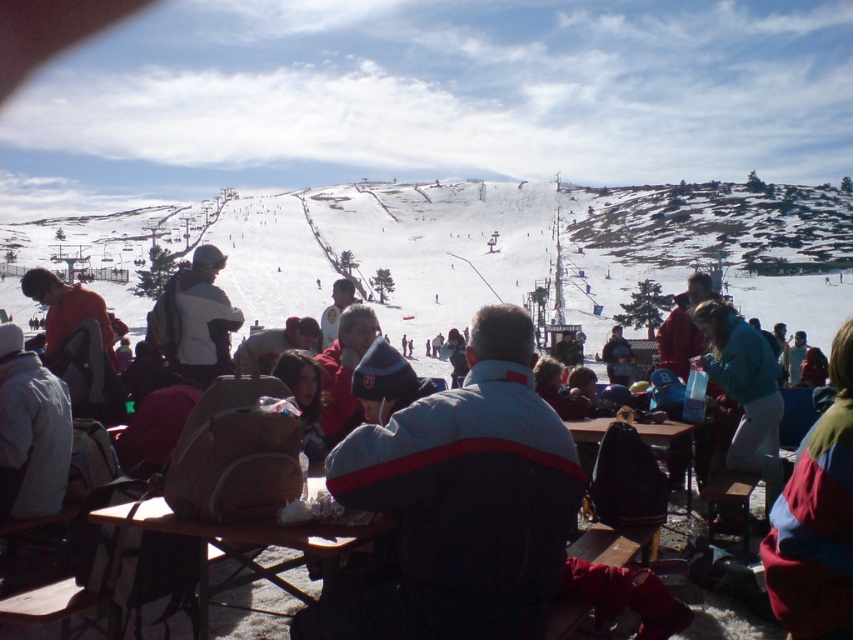
Question: In this image, where is multicolored fabric jacket at lower right located relative to matte gray backpack at center?

Choices:
 (A) right
 (B) left

Answer: (A)

Question: Among these objects, which one is nearest to the camera?

Choices:
 (A) brown wooden table at center
 (B) matte gray backpack at center
 (C) teal fleece jacket at center
 (D) multicolored fabric jacket at lower right

Answer: (D)

Question: Which point is farther from the camera taking this photo?

Choices:
 (A) (727, 616)
 (B) (715, 364)
 (C) (178, 332)

Answer: (C)

Question: Can you confirm if multicolored fabric jacket at lower right is smaller than teal fleece jacket at center?

Choices:
 (A) no
 (B) yes

Answer: (A)

Question: Observing the image, what is the correct spatial positioning of brown wooden table at center in reference to matte gray backpack at center?

Choices:
 (A) left
 (B) right

Answer: (A)

Question: Which object is positioned farthest from the multicolored fabric jacket at lower right?

Choices:
 (A) white fleece jacket at center
 (B) teal fleece jacket at center
 (C) brown wooden table at center
 (D) matte gray backpack at center

Answer: (A)